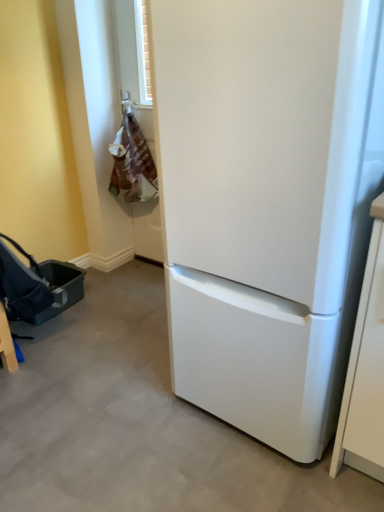
Question: Should I look upward or downward to see white matte refrigerator at center?

Choices:
 (A) down
 (B) up

Answer: (B)